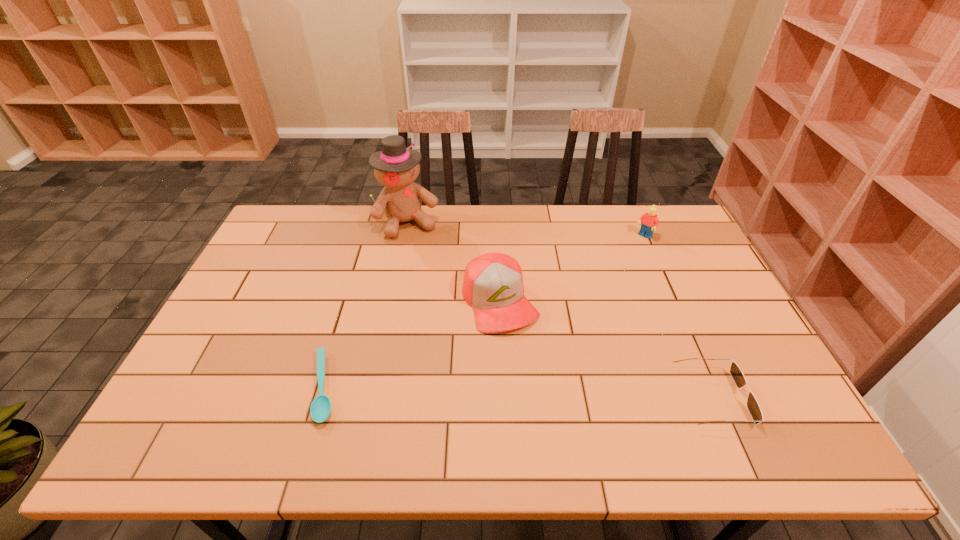
This screenshot has width=960, height=540. I want to click on free spot located 0.180m on the face of the Lego, so click(x=612, y=267).

The height and width of the screenshot is (540, 960). In order to click on free region located on the face of the Lego in this screenshot , I will do `click(575, 305)`.

Locate an element on the screen. vacant area situated 0.350m on the face of the Lego is located at coordinates (585, 296).

Image resolution: width=960 pixels, height=540 pixels. Identify the location of vacant space located 0.260m on the front-facing side of the tallest object. point(444,288).

Find the location of a particular element. free space located on the front-facing side of the tallest object is located at coordinates (423, 251).

Identify the location of vacant space located on the front-facing side of the tallest object. The width and height of the screenshot is (960, 540). (426, 256).

At what (x,y) coordinates should I click in order to perform the action: click on Lego situated at the far edge. Please return your answer as a coordinate pair (x, y). Image resolution: width=960 pixels, height=540 pixels. Looking at the image, I should click on [x=649, y=220].

Find the location of a particular element. The width and height of the screenshot is (960, 540). rag_doll at the far edge is located at coordinates (396, 167).

Image resolution: width=960 pixels, height=540 pixels. Identify the location of spoon at the near edge. (320, 409).

Image resolution: width=960 pixels, height=540 pixels. I want to click on sunglasses present at the near edge, so click(x=736, y=373).